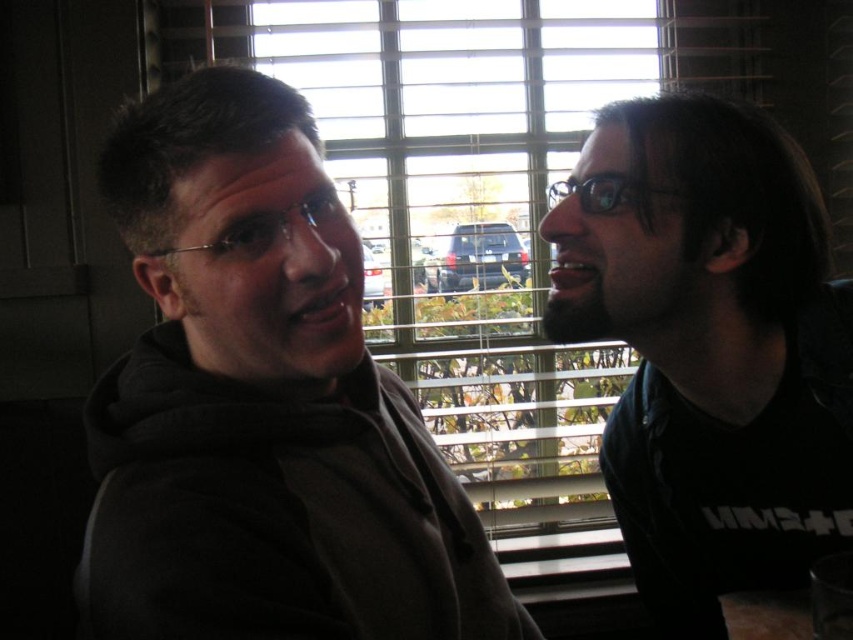
You are a photographer trying to capture a candid shot of both the dark gray hoodie at left and the black matte shirt at right. Since you want both subjects to be clearly visible in the photo, which one should you focus on first to ensure proper depth of field?

The dark gray hoodie at left is in front of the black matte shirt at right, so focusing on the dark gray hoodie at left first will ensure that it remains sharp while the background subject may blur slightly. To get both in focus, adjust the aperture for a deeper depth of field.

You are a photographer trying to capture a photo of both the dark gray hoodie at left and the black matte shirt at right in the same frame. Based on their positions, which direction should you move to ensure both are fully visible in your camera viewfinder?

Since the dark gray hoodie at left is to the left of the black matte shirt at right, you should move to the left to ensure both are fully visible in the camera viewfinder.